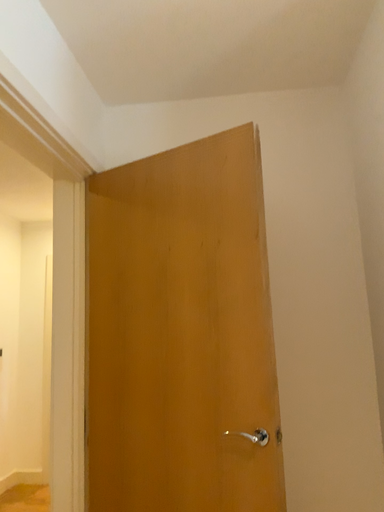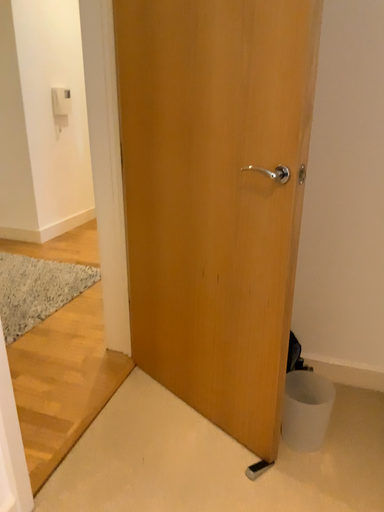
Question: Which way did the camera rotate in the video?

Choices:
 (A) rotated left
 (B) rotated right

Answer: (A)